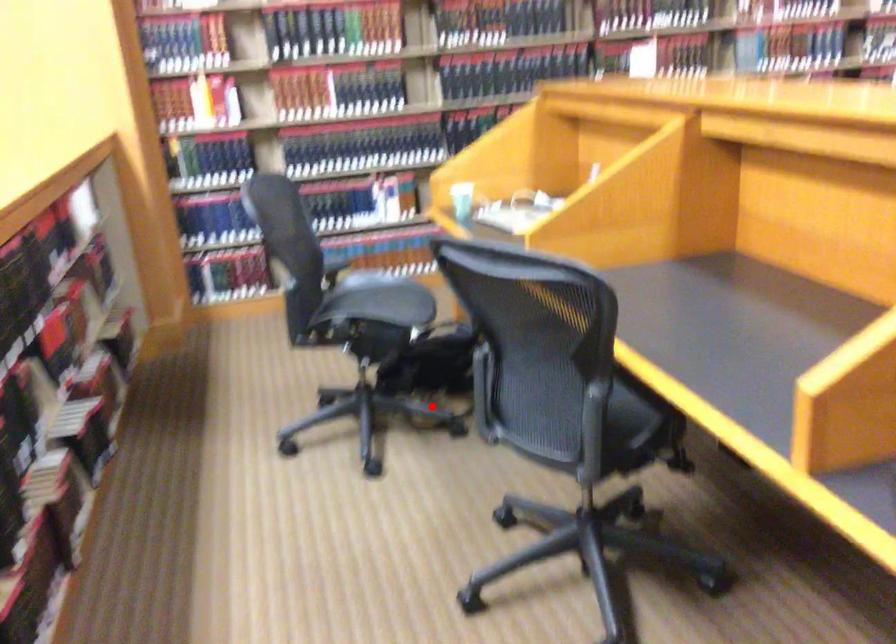
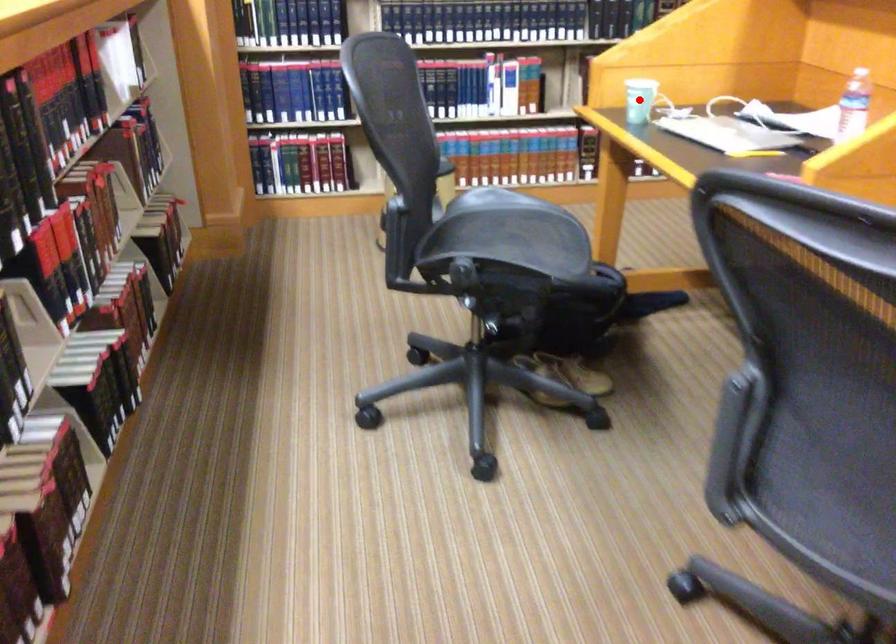
I am providing you with two images of the same scene from different viewpoints. A red point is marked on the first image and another point is marked on the second image. Is the red point in image1 aligned with the point shown in image2?

No